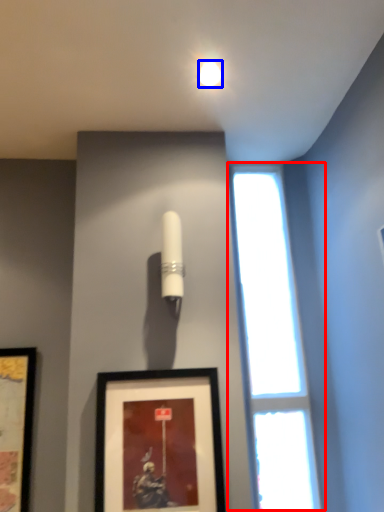
Question: Among these objects, which one is farthest to the camera, window (highlighted by a red box) or lighting (highlighted by a blue box)?

Choices:
 (A) window
 (B) lighting

Answer: (A)